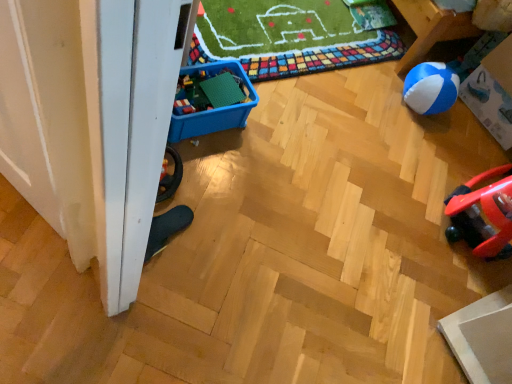
Question: From the image's perspective, does green plastic building blocks at center-left appear lower than blue and white plastic storage box at right, the 1th storage box when ordered from right to left?

Choices:
 (A) no
 (B) yes

Answer: (B)

Question: Can you confirm if green plastic building blocks at center-left is wider than blue and white plastic storage box at right, positioned as the 2th storage box in left-to-right order?

Choices:
 (A) yes
 (B) no

Answer: (B)

Question: Can you confirm if green plastic building blocks at center-left is smaller than blue and white plastic storage box at right, which appears as the first storage box when viewed from the back?

Choices:
 (A) no
 (B) yes

Answer: (B)

Question: Could you tell me if green plastic building blocks at center-left is turned towards blue and white plastic storage box at right, positioned as the 2th storage box in left-to-right order?

Choices:
 (A) no
 (B) yes

Answer: (B)

Question: From a real-world perspective, is green plastic building blocks at center-left beneath blue and white plastic storage box at right, positioned as the 2th storage box in left-to-right order?

Choices:
 (A) no
 (B) yes

Answer: (B)

Question: Based on their sizes in the image, would you say blue plastic storage box at lower left, which is the second storage box from back to front, is bigger or smaller than green plastic building blocks at center-left?

Choices:
 (A) big
 (B) small

Answer: (A)

Question: Would you say blue plastic storage box at lower left, the first storage box positioned from the left, is to the left or to the right of green plastic building blocks at center-left in the picture?

Choices:
 (A) right
 (B) left

Answer: (B)

Question: From a real-world perspective, is blue plastic storage box at lower left, the second storage box when ordered from right to left, above or below green plastic building blocks at center-left?

Choices:
 (A) below
 (B) above

Answer: (A)

Question: In terms of width, does blue plastic storage box at lower left, the first storage box positioned from the left, look wider or thinner when compared to green plastic building blocks at center-left?

Choices:
 (A) wide
 (B) thin

Answer: (A)

Question: From a real-world perspective, is green plastic building blocks at center-left positioned above or below blue and white rubber ball at right?

Choices:
 (A) above
 (B) below

Answer: (A)

Question: Based on their sizes in the image, would you say green plastic building blocks at center-left is bigger or smaller than blue and white rubber ball at right?

Choices:
 (A) small
 (B) big

Answer: (A)

Question: Considering the relative positions of green plastic building blocks at center-left and blue and white rubber ball at right in the image provided, is green plastic building blocks at center-left to the left or to the right of blue and white rubber ball at right?

Choices:
 (A) left
 (B) right

Answer: (A)

Question: Considering the positions of green plastic building blocks at center-left and blue and white rubber ball at right in the image, is green plastic building blocks at center-left taller or shorter than blue and white rubber ball at right?

Choices:
 (A) short
 (B) tall

Answer: (A)

Question: Would you say blue plastic storage box at lower left, which is the second storage box from back to front, is to the left or to the right of blue and white plastic storage box at right, the 1th storage box when ordered from right to left, in the picture?

Choices:
 (A) left
 (B) right

Answer: (A)

Question: Looking at their shapes, would you say blue plastic storage box at lower left, which is the second storage box from back to front, is wider or thinner than blue and white plastic storage box at right, which appears as the first storage box when viewed from the back?

Choices:
 (A) wide
 (B) thin

Answer: (B)